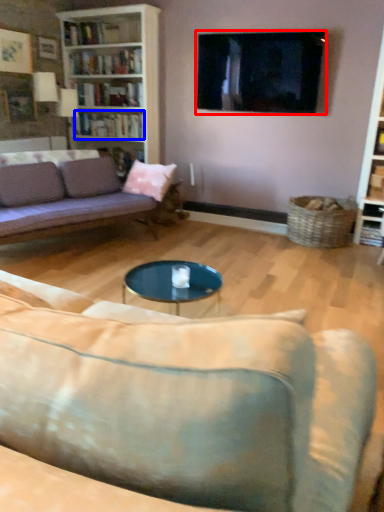
Question: Which object is further to the camera taking this photo, television (highlighted by a red box) or book (highlighted by a blue box)?

Choices:
 (A) television
 (B) book

Answer: (B)